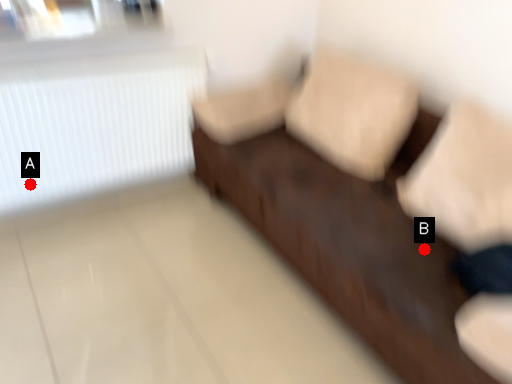
Question: Two points are circled on the image, labeled by A and B beside each circle. Which point is farther to the camera?

Choices:
 (A) A is further
 (B) B is further

Answer: (A)